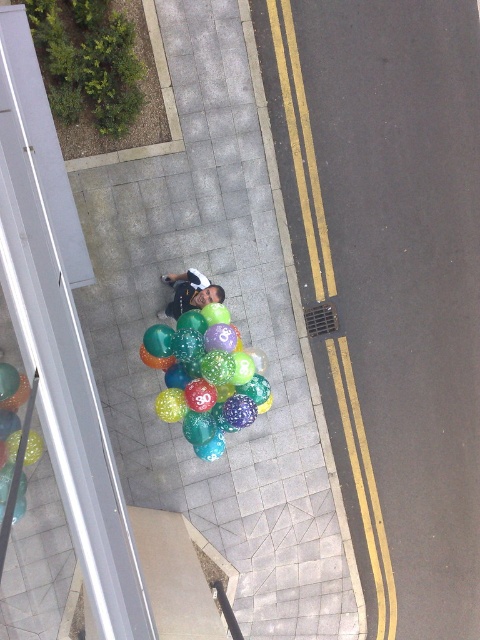
Can you confirm if smooth concrete sidewalk at center is positioned below smooth concrete pavement at center?

Actually, smooth concrete sidewalk at center is above smooth concrete pavement at center.

Does smooth concrete sidewalk at center have a smaller size compared to smooth concrete pavement at center?

Indeed, smooth concrete sidewalk at center has a smaller size compared to smooth concrete pavement at center.

Is point (456, 620) farther from viewer compared to point (274, 602)?

Yes, point (456, 620) is farther from viewer.

At what (x,y) coordinates should I click in order to perform the action: click on smooth concrete sidewalk at center. Please return your answer as a coordinate pair (x, y). The width and height of the screenshot is (480, 640). Looking at the image, I should click on (389, 280).

Who is taller, smooth concrete pavement at center or translucent glossy balloons at center?

With more height is smooth concrete pavement at center.

Is smooth concrete pavement at center bigger than translucent glossy balloons at center?

Yes, smooth concrete pavement at center is bigger than translucent glossy balloons at center.

Does point (263, 173) come behind point (204, 369)?

Yes, point (263, 173) is behind point (204, 369).

The image size is (480, 640). What are the coordinates of `smooth concrete pavement at center` in the screenshot? It's located at (232, 320).

Does shiny metallic balloon at center lie behind matte black shirt at center?

No, it is not.

Does shiny metallic balloon at center appear over matte black shirt at center?

No, shiny metallic balloon at center is not above matte black shirt at center.

Does point (3, 362) come behind point (177, 300)?

No, it is in front of (177, 300).

Find the location of `shiny metallic balloon at center`. shiny metallic balloon at center is located at coordinates (16, 458).